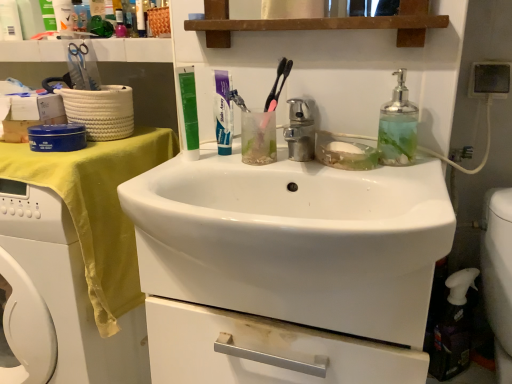
Find the location of a particular element. free space in front of white glossy toothpaste at center is located at coordinates (206, 169).